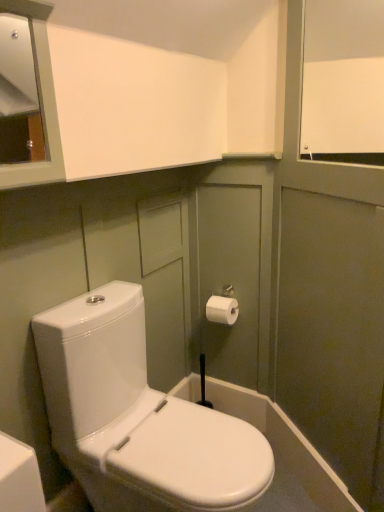
Question: Is white matte window screen at upper right looking in the opposite direction of white paper toilet paper at upper right?

Choices:
 (A) yes
 (B) no

Answer: (B)

Question: From the image's perspective, would you say white matte window screen at upper right is positioned over white paper toilet paper at upper right?

Choices:
 (A) yes
 (B) no

Answer: (A)

Question: Is white matte window screen at upper right facing towards white paper toilet paper at upper right?

Choices:
 (A) yes
 (B) no

Answer: (B)

Question: Is white matte window screen at upper right beside white paper toilet paper at upper right?

Choices:
 (A) yes
 (B) no

Answer: (B)

Question: Is there a large distance between white matte window screen at upper right and white paper toilet paper at upper right?

Choices:
 (A) yes
 (B) no

Answer: (B)

Question: Considering the relative positions of white matte window screen at upper right and white paper toilet paper at upper right in the image provided, is white matte window screen at upper right to the left of white paper toilet paper at upper right from the viewer's perspective?

Choices:
 (A) no
 (B) yes

Answer: (A)

Question: Is white paper toilet paper at upper right not close to white matte window screen at upper right?

Choices:
 (A) yes
 (B) no

Answer: (B)

Question: Does white paper toilet paper at upper right have a smaller size compared to white matte window screen at upper right?

Choices:
 (A) no
 (B) yes

Answer: (B)

Question: Could you tell me if white paper toilet paper at upper right is facing white matte window screen at upper right?

Choices:
 (A) no
 (B) yes

Answer: (A)

Question: Can you confirm if white paper toilet paper at upper right is bigger than white matte window screen at upper right?

Choices:
 (A) yes
 (B) no

Answer: (B)

Question: Is white paper toilet paper at upper right positioned beyond the bounds of white matte window screen at upper right?

Choices:
 (A) no
 (B) yes

Answer: (B)

Question: Can you confirm if white paper toilet paper at upper right is wider than white matte window screen at upper right?

Choices:
 (A) yes
 (B) no

Answer: (A)

Question: Is white matte window screen at upper right to the right of white glossy toilet at center from the viewer's perspective?

Choices:
 (A) yes
 (B) no

Answer: (A)